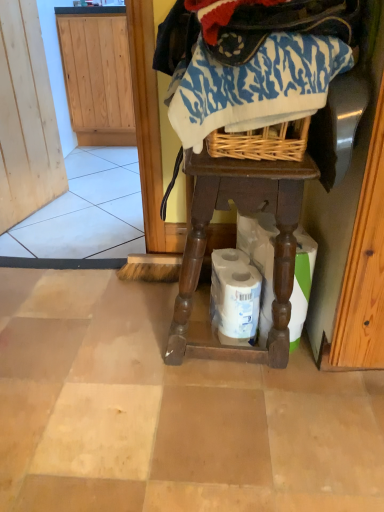
Question: Does white matte toilet paper at lower center, which ranks as the 1th toilet paper in right-to-left order, appear on the right side of blue printed fabric at center?

Choices:
 (A) no
 (B) yes

Answer: (B)

Question: Is blue printed fabric at center at the back of white matte toilet paper at lower center, which ranks as the 2th toilet paper in left-to-right order?

Choices:
 (A) no
 (B) yes

Answer: (A)

Question: Can you confirm if white matte toilet paper at lower center, which ranks as the 1th toilet paper in right-to-left order, is shorter than blue printed fabric at center?

Choices:
 (A) yes
 (B) no

Answer: (B)

Question: Can you confirm if white matte toilet paper at lower center, which ranks as the 2th toilet paper in left-to-right order, is taller than blue printed fabric at center?

Choices:
 (A) no
 (B) yes

Answer: (B)

Question: Would you say white matte toilet paper at lower center, which ranks as the 2th toilet paper in left-to-right order, is outside blue printed fabric at center?

Choices:
 (A) no
 (B) yes

Answer: (B)

Question: Visually, is blue printed fabric at center positioned to the left or to the right of white matte toilet paper at lower center, placed as the second toilet paper when sorted from right to left?

Choices:
 (A) left
 (B) right

Answer: (A)

Question: Is blue printed fabric at center inside or outside of white matte toilet paper at lower center, placed as the second toilet paper when sorted from right to left?

Choices:
 (A) outside
 (B) inside

Answer: (A)

Question: Does point (185, 113) appear closer or farther from the camera than point (238, 280)?

Choices:
 (A) closer
 (B) farther

Answer: (A)

Question: Considering their positions, is blue printed fabric at center located in front of or behind white matte toilet paper at lower center, which is the 1th toilet paper in left-to-right order?

Choices:
 (A) front
 (B) behind

Answer: (A)

Question: Looking at their shapes, would you say brown wooden table at center is wider or thinner than white matte toilet paper at lower center, placed as the second toilet paper when sorted from right to left?

Choices:
 (A) wide
 (B) thin

Answer: (A)

Question: In the image, is brown wooden table at center positioned in front of or behind white matte toilet paper at lower center, placed as the second toilet paper when sorted from right to left?

Choices:
 (A) front
 (B) behind

Answer: (A)

Question: Is point (183, 276) positioned closer to the camera than point (244, 323)?

Choices:
 (A) closer
 (B) farther

Answer: (A)

Question: In terms of height, does brown wooden table at center look taller or shorter compared to white matte toilet paper at lower center, placed as the second toilet paper when sorted from right to left?

Choices:
 (A) tall
 (B) short

Answer: (A)

Question: In the image, is brown wooden table at center positioned in front of or behind blue printed fabric at center?

Choices:
 (A) behind
 (B) front

Answer: (A)

Question: Is point (284, 167) closer or farther from the camera than point (211, 99)?

Choices:
 (A) farther
 (B) closer

Answer: (A)